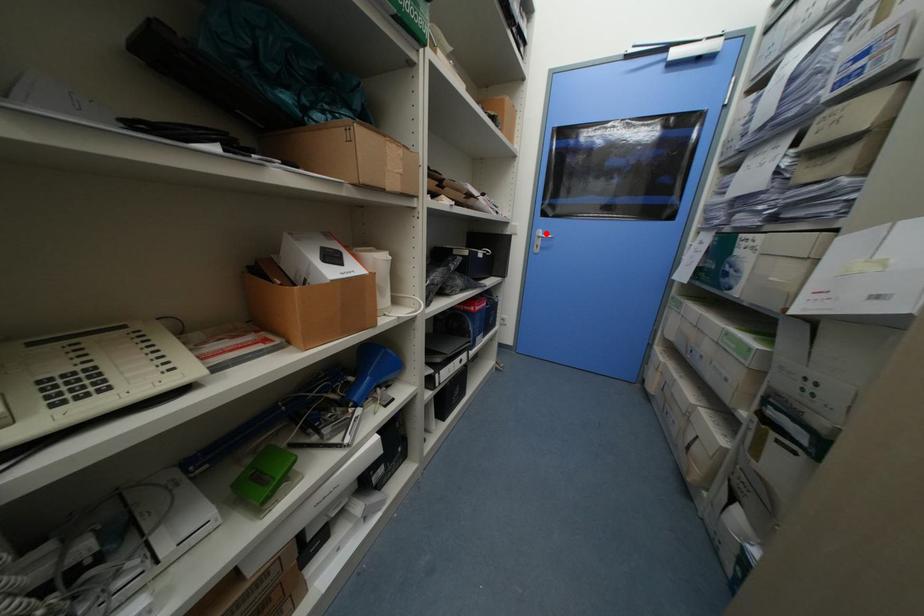
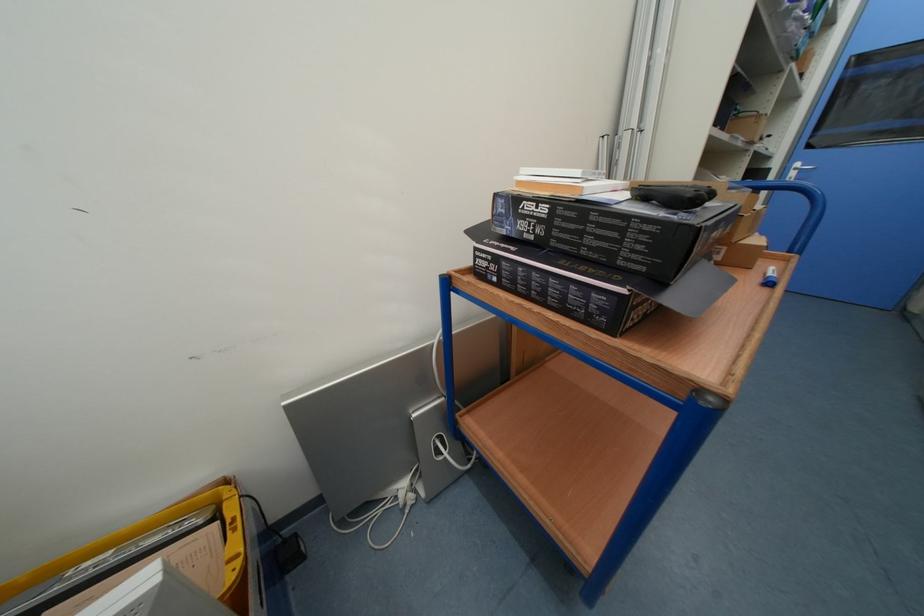
Question: I am providing you with two images of the same scene from different viewpoints. Given a red point in image1, look at the same physical point in image2. Is it:

Choices:
 (A) Closer to the viewpoint
 (B) Farther from the viewpoint

Answer: (B)